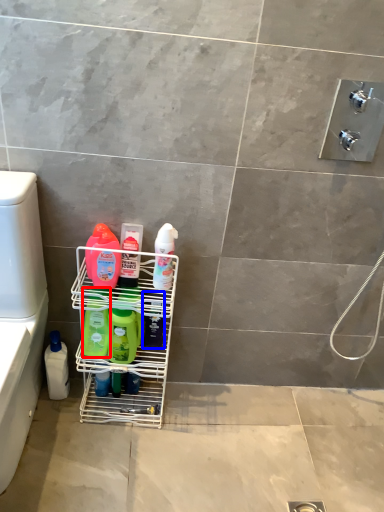
Question: Among these objects, which one is farthest to the camera, cleaning product (highlighted by a red box) or cleaning product (highlighted by a blue box)?

Choices:
 (A) cleaning product
 (B) cleaning product

Answer: (B)